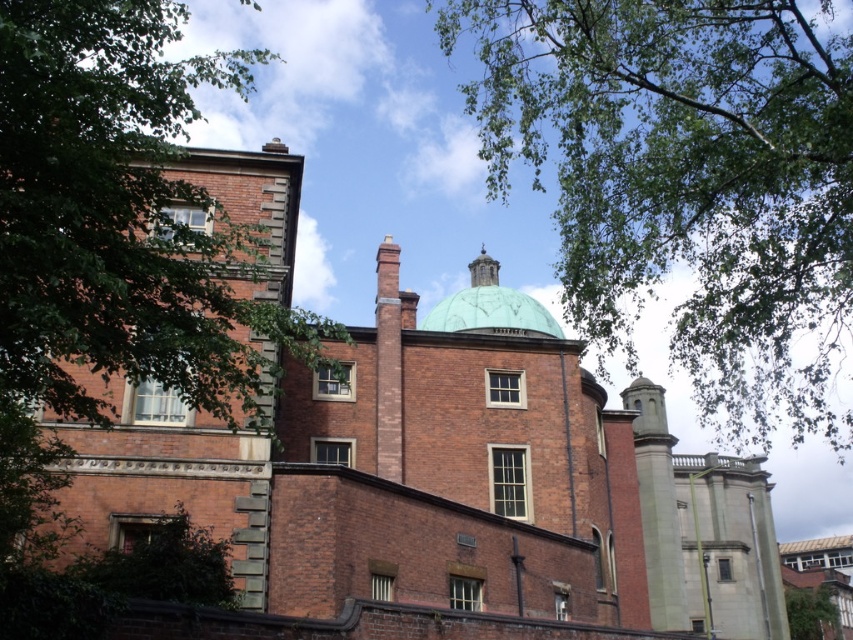
Question: Is green leafy tree at upper center to the right of green leafy tree at lower right from the viewer's perspective?

Choices:
 (A) yes
 (B) no

Answer: (B)

Question: Which of the following is the closest to the observer?

Choices:
 (A) (792, 632)
 (B) (447, 298)

Answer: (B)

Question: Which point appears closest to the camera in this image?

Choices:
 (A) (558, 330)
 (B) (793, 602)
 (C) (679, 52)

Answer: (C)

Question: Does green leafy tree at upper center have a lesser width compared to green leafy tree at lower right?

Choices:
 (A) yes
 (B) no

Answer: (B)

Question: Is the position of green leafy tree at upper center more distant than that of green matte dome at center?

Choices:
 (A) no
 (B) yes

Answer: (A)

Question: Which object is closer to the camera taking this photo?

Choices:
 (A) green matte dome at center
 (B) green leafy tree at upper center
 (C) green leafy tree at lower right

Answer: (B)